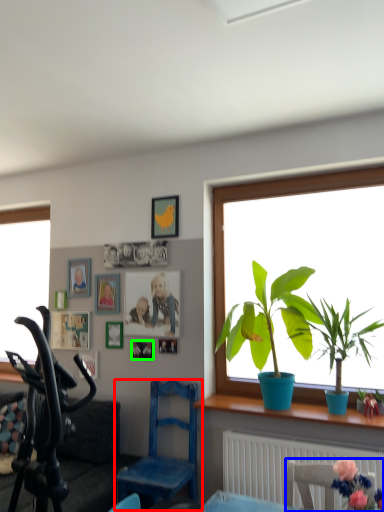
Question: Which object is the farthest from chair (highlighted by a red box)? Choose among these: chair (highlighted by a blue box) or picture frame (highlighted by a green box).

Choices:
 (A) chair
 (B) picture frame

Answer: (A)